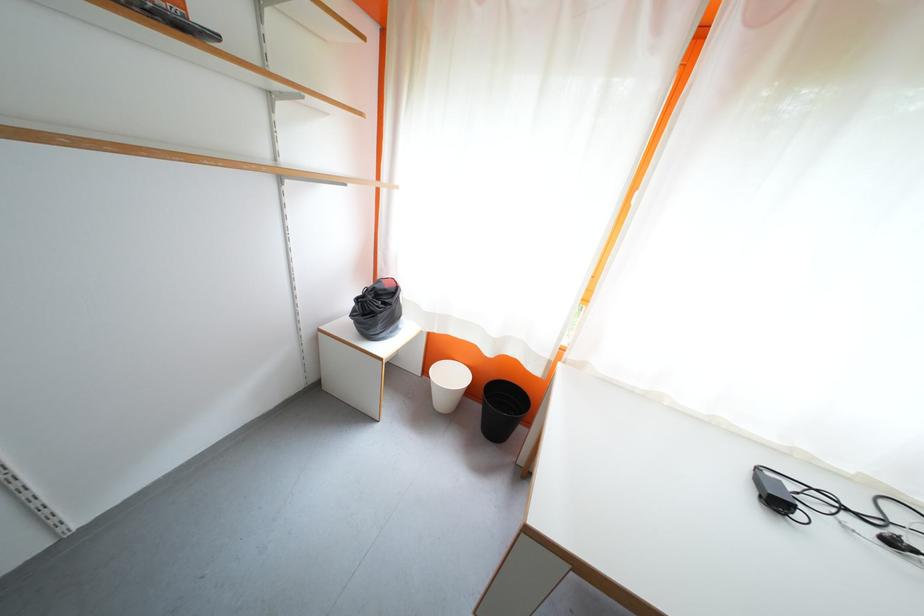
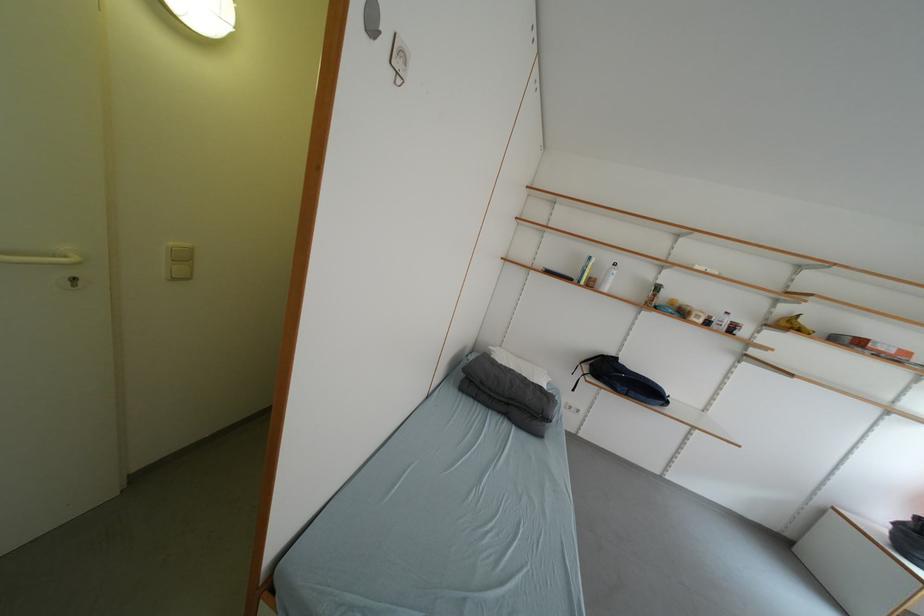
Locate, in the second image, the point that corresponds to point (324, 342) in the first image.

(832, 515)